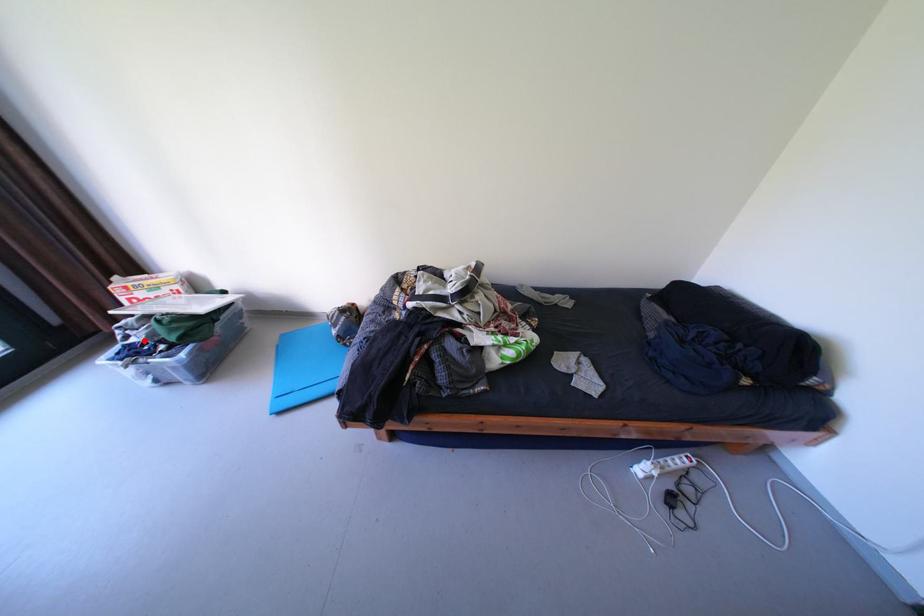
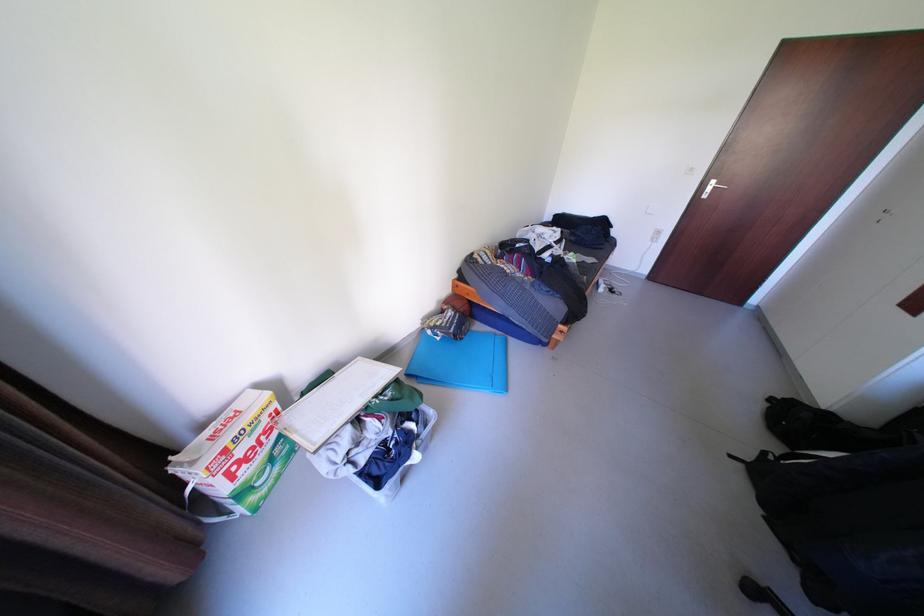
In the second image, find the point that corresponds to the highlighted location in the first image.

(372, 459)